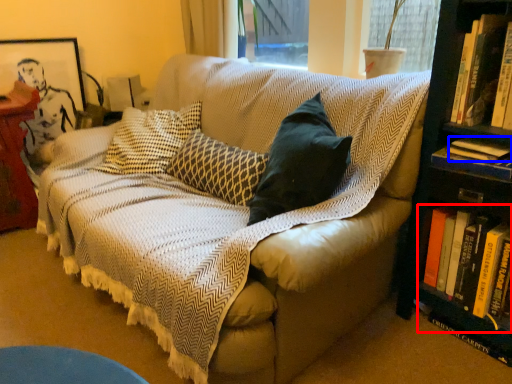
Question: Which object appears closest to the camera in this image, book (highlighted by a red box) or book (highlighted by a blue box)?

Choices:
 (A) book
 (B) book

Answer: (A)